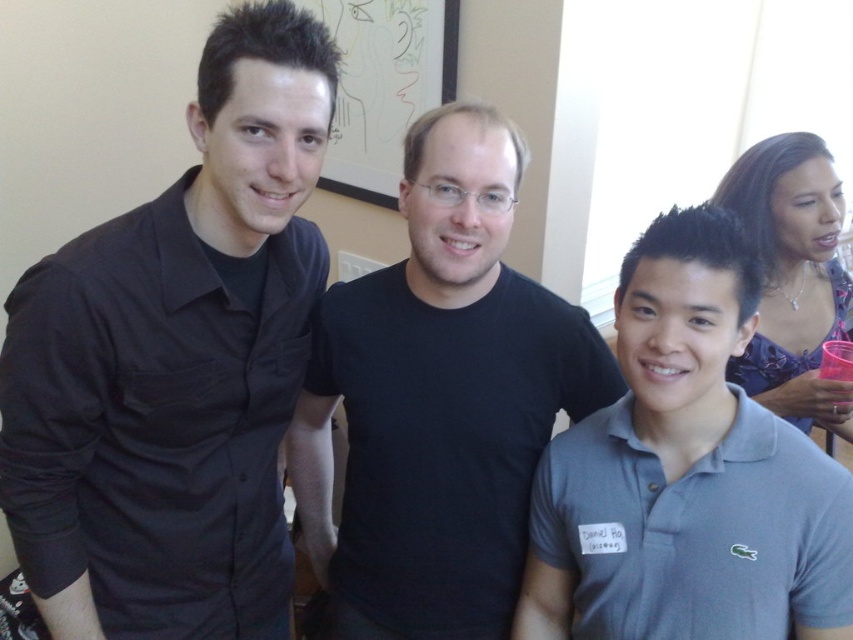
You are organizing a photo album and need to place the image in a section based on clothing colors. The gray cotton polo shirt at center and the blue floral dress at upper right are visible. Which clothing item is located to the left of the other?

The gray cotton polo shirt at center is positioned on the left side of blue floral dress at upper right.

You are at a party and want to greet the person wearing the blue floral dress at upper right. Which direction should you move from the black matte shirt at left to reach them?

The blue floral dress at upper right is to the right of the black matte shirt at left, so you should move to the right.

You are taking a photo of these men and want to focus on the point closer to the camera. Which point should you choose between point (56, 476) and point (350, 340)?

Point (56, 476) is closer to the camera than point (350, 340), so you should choose point (56, 476) to focus on.